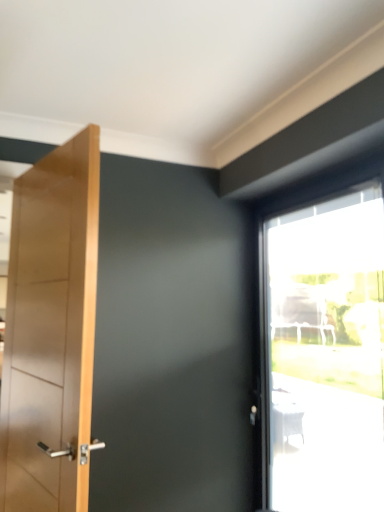
Question: Looking at their shapes, would you say transparent glass window at upper right is wider or thinner than light brown wooden door at left?

Choices:
 (A) thin
 (B) wide

Answer: (B)

Question: From a real-world perspective, relative to light brown wooden door at left, is transparent glass window at upper right vertically above or below?

Choices:
 (A) above
 (B) below

Answer: (B)

Question: Is transparent glass window at upper right in front of or behind light brown wooden door at left in the image?

Choices:
 (A) behind
 (B) front

Answer: (A)

Question: Is light brown wooden door at left spatially inside transparent glass window at upper right, or outside of it?

Choices:
 (A) outside
 (B) inside

Answer: (A)

Question: Considering the positions of point (67, 407) and point (289, 194), is point (67, 407) closer or farther from the camera than point (289, 194)?

Choices:
 (A) closer
 (B) farther

Answer: (A)

Question: From the image's perspective, relative to transparent glass window at upper right, is light brown wooden door at left above or below?

Choices:
 (A) below
 (B) above

Answer: (B)

Question: From a real-world perspective, relative to transparent glass window at upper right, is light brown wooden door at left vertically above or below?

Choices:
 (A) above
 (B) below

Answer: (A)